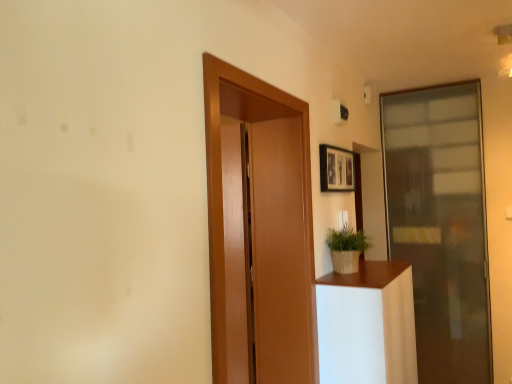
Question: From the image's perspective, is transparent glass door at right, which is the second door from front to back, above or below wooden framed picture at upper right?

Choices:
 (A) above
 (B) below

Answer: (B)

Question: From a real-world perspective, relative to wooden framed picture at upper right, is transparent glass door at right, which is the first door from back to front, vertically above or below?

Choices:
 (A) below
 (B) above

Answer: (A)

Question: Estimate the real-world distances between objects in this image. Which object is farther from the wooden door at center, arranged as the second door when viewed from the right?

Choices:
 (A) transparent glass door at right, which is the first door from back to front
 (B) green woven basket at right
 (C) white matte plant pot at right
 (D) wooden framed picture at upper right

Answer: (A)

Question: Which object is positioned farthest from the wooden framed picture at upper right?

Choices:
 (A) white matte plant pot at right
 (B) wooden door at center, which appears as the 1th door when viewed from the left
 (C) green woven basket at right
 (D) transparent glass door at right, which is the second door from front to back

Answer: (D)